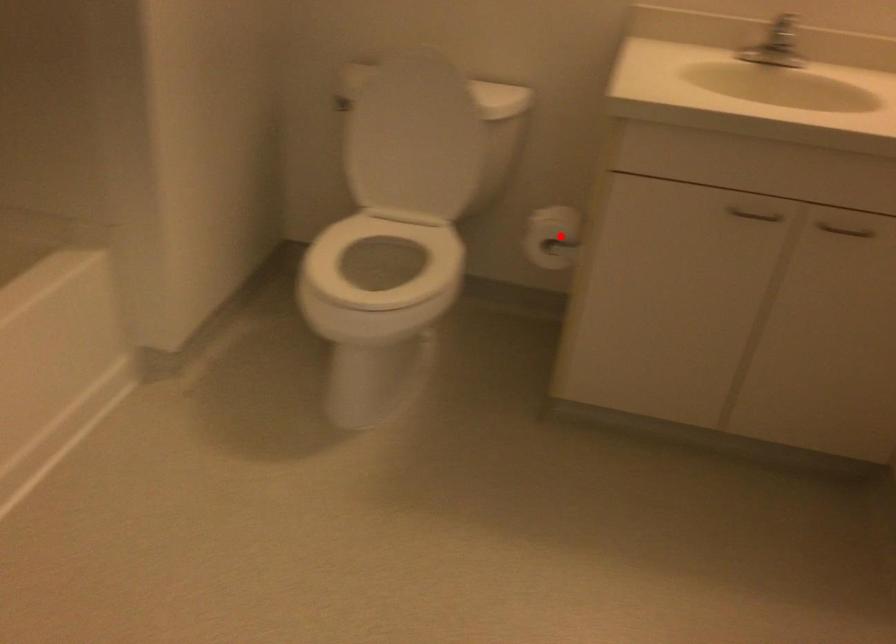
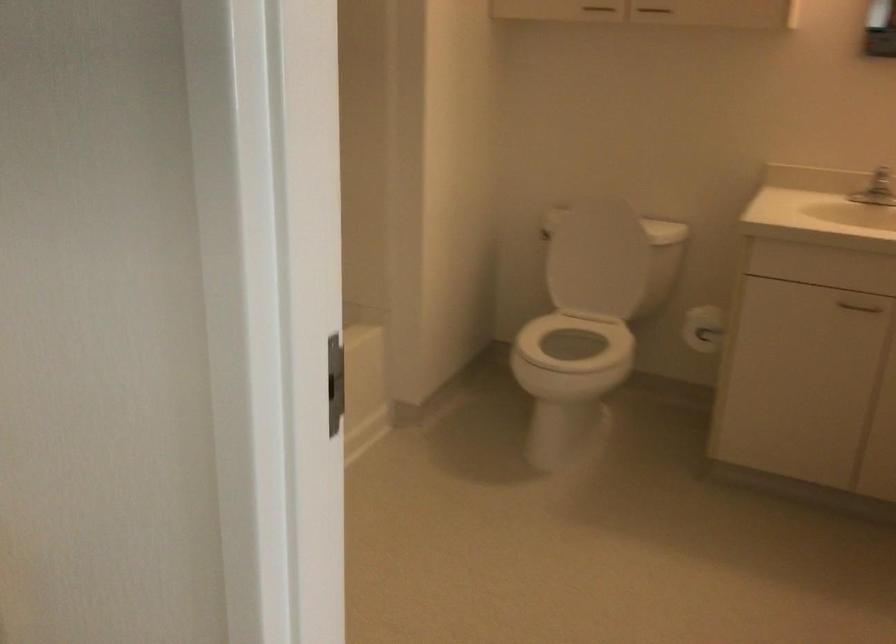
Question: I am providing you with two images of the same scene from different viewpoints. In image1, a red point is highlighted. Considering the same 3D point in image2, which of the following is correct?

Choices:
 (A) It is closer
 (B) It is farther

Answer: (B)